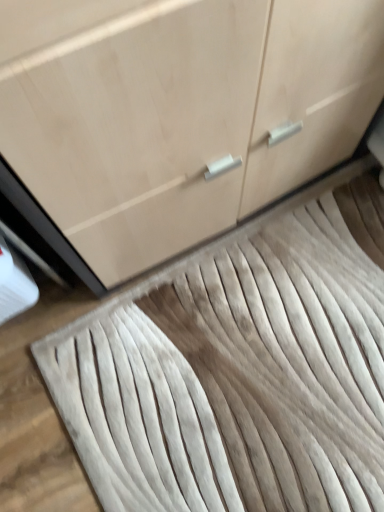
This screenshot has height=512, width=384. I want to click on matte wood cabinet at center, so click(175, 117).

The height and width of the screenshot is (512, 384). What do you see at coordinates (175, 117) in the screenshot?
I see `matte wood cabinet at center` at bounding box center [175, 117].

What are the coordinates of `white textured rug at center` in the screenshot? It's located at (240, 373).

The image size is (384, 512). Describe the element at coordinates (240, 373) in the screenshot. I see `white textured rug at center` at that location.

Where is `matte wood cabinet at center`? The image size is (384, 512). matte wood cabinet at center is located at coordinates (175, 117).

Is white textured rug at center to the left of matte wood cabinet at center from the viewer's perspective?

Incorrect, white textured rug at center is not on the left side of matte wood cabinet at center.

Considering their positions, is white textured rug at center located in front of or behind matte wood cabinet at center?

Clearly, white textured rug at center is behind matte wood cabinet at center.

Considering the points (68, 361) and (92, 51), which point is behind, point (68, 361) or point (92, 51)?

The point (68, 361) is farther.

From the image's perspective, is white textured rug at center below matte wood cabinet at center?

Yes, from the image's perspective, white textured rug at center is beneath matte wood cabinet at center.

From a real-world perspective, is white textured rug at center under matte wood cabinet at center?

Correct, in the physical world, white textured rug at center is lower than matte wood cabinet at center.

Between white textured rug at center and matte wood cabinet at center, which one has smaller width?

With smaller width is matte wood cabinet at center.

Does white textured rug at center have a greater height compared to matte wood cabinet at center?

Incorrect, the height of white textured rug at center is not larger of that of matte wood cabinet at center.

Is white textured rug at center bigger than matte wood cabinet at center?

No, white textured rug at center is not bigger than matte wood cabinet at center.

Would you say white textured rug at center is inside or outside matte wood cabinet at center?

white textured rug at center cannot be found inside matte wood cabinet at center.

Is the surface of white textured rug at center in direct contact with matte wood cabinet at center?

No, white textured rug at center is not making contact with matte wood cabinet at center.

Looking at this image, is matte wood cabinet at center at the back of white textured rug at center?

No, white textured rug at center is not facing away from matte wood cabinet at center.

What's the angular difference between white textured rug at center and matte wood cabinet at center's facing directions?

89 degrees.

Measure the distance from white textured rug at center to matte wood cabinet at center.

A distance of 36.67 centimeters exists between white textured rug at center and matte wood cabinet at center.

Locate an element on the screen. The image size is (384, 512). cabinetry above the white textured rug at center (from the image's perspective) is located at coordinates (175, 117).

Is matte wood cabinet at center at the right side of white textured rug at center?

Incorrect, matte wood cabinet at center is not on the right side of white textured rug at center.

Is matte wood cabinet at center positioned before white textured rug at center?

Yes, matte wood cabinet at center is closer to the viewer.

Is point (277, 104) closer to camera compared to point (251, 229)?

Yes, point (277, 104) is in front of point (251, 229).

From the image's perspective, which is below, matte wood cabinet at center or white textured rug at center?

white textured rug at center appears lower in the image.

From a real-world perspective, is matte wood cabinet at center physically located above or below white textured rug at center?

From a real-world perspective, matte wood cabinet at center is physically above white textured rug at center.

Is matte wood cabinet at center wider or thinner than white textured rug at center?

Clearly, matte wood cabinet at center has less width compared to white textured rug at center.

Who is taller, matte wood cabinet at center or white textured rug at center?

With more height is matte wood cabinet at center.

Who is bigger, matte wood cabinet at center or white textured rug at center?

Bigger between the two is matte wood cabinet at center.

Is matte wood cabinet at center inside the boundaries of white textured rug at center, or outside?

matte wood cabinet at center is located beyond the bounds of white textured rug at center.

Is matte wood cabinet at center next to white textured rug at center?

They are not placed beside each other.

Is matte wood cabinet at center aimed at white textured rug at center?

Yes, matte wood cabinet at center is facing white textured rug at center.

Find the location of a particular element. Image resolution: width=384 pixels, height=512 pixels. doormat that is on the right side of matte wood cabinet at center is located at coordinates (240, 373).

Image resolution: width=384 pixels, height=512 pixels. In the image, there is a matte wood cabinet at center. Identify the location of doormat below it (from a real-world perspective). (240, 373).

Find the location of a particular element. doormat below the matte wood cabinet at center (from the image's perspective) is located at coordinates (240, 373).